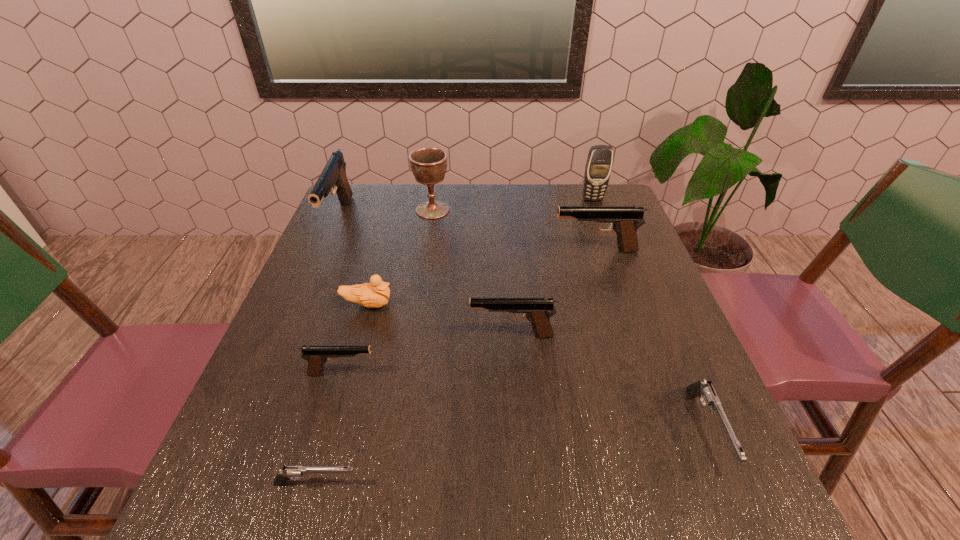
Identify the location of black pistol that is the third closest to the seventh farthest object. (625, 220).

Where is `black pistol that is the nearest to the brown chalice`? The width and height of the screenshot is (960, 540). black pistol that is the nearest to the brown chalice is located at coordinates (333, 175).

Find the location of `free point that satisfies the following two spatial constraints: 1. on the front face of the cellular telephone; 2. at the muzzle of the fifth shortest object`. free point that satisfies the following two spatial constraints: 1. on the front face of the cellular telephone; 2. at the muzzle of the fifth shortest object is located at coordinates (642, 335).

I want to click on vacant region that satisfies the following two spatial constraints: 1. on the front-facing side of the right silver pistol; 2. on the front-facing side of the shortest object, so click(731, 484).

This screenshot has width=960, height=540. What are the coordinates of `free space that satisfies the following two spatial constraints: 1. on the front face of the cellular telephone; 2. at the muzzle of the smallest black pistol` in the screenshot? It's located at (656, 373).

This screenshot has height=540, width=960. Identify the location of free spot that satisfies the following two spatial constraints: 1. on the front face of the cellular telephone; 2. at the muzzle of the sixth object from left to right. (642, 335).

The image size is (960, 540). I want to click on vacant region that satisfies the following two spatial constraints: 1. on the front-facing side of the bigger silver pistol; 2. on the front-facing side of the shortest object, so click(x=731, y=484).